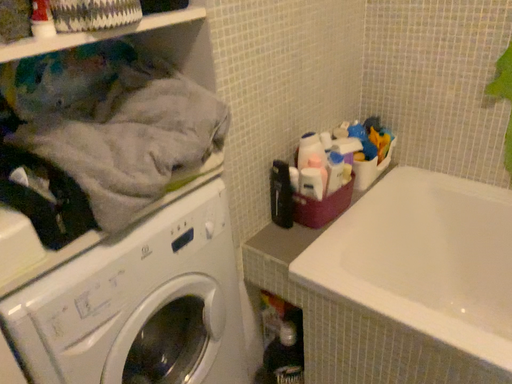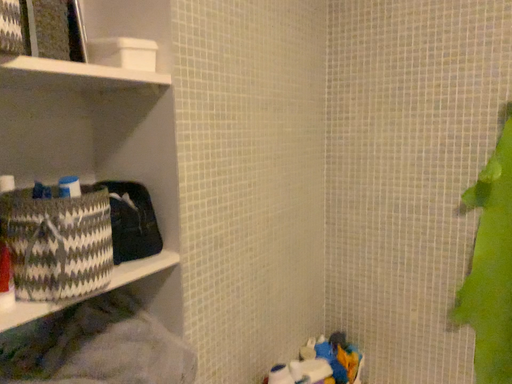
Question: How did the camera likely rotate when shooting the video?

Choices:
 (A) rotated downward
 (B) rotated upward

Answer: (B)